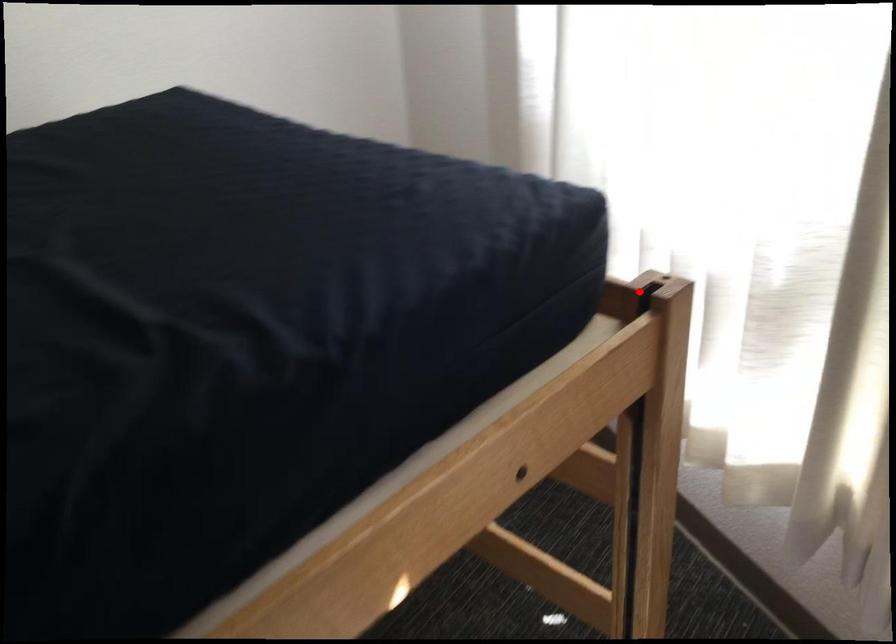
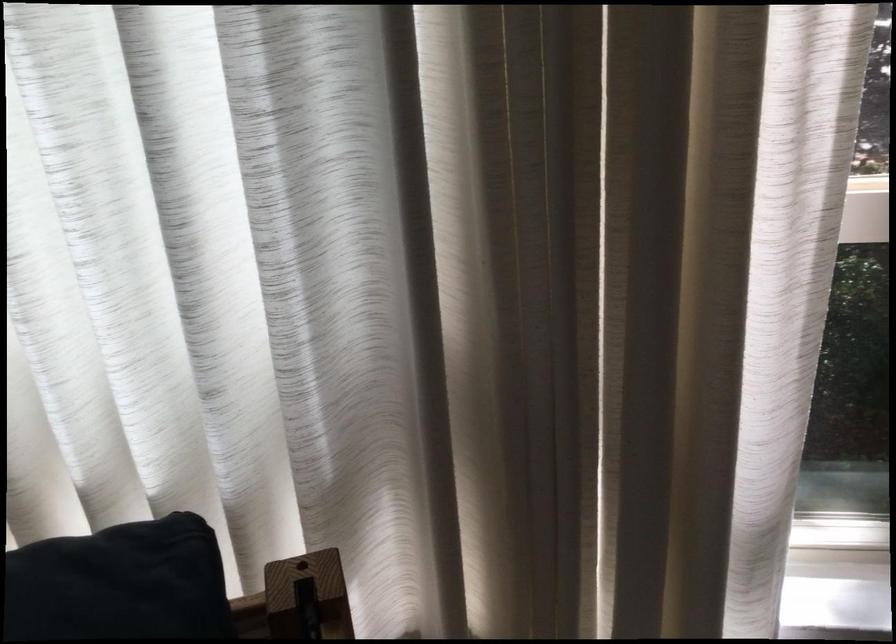
Question: I am providing you with two images of the same scene from different viewpoints. Given a red point in image1, look at the same physical point in image2. Is it:

Choices:
 (A) Closer to the viewpoint
 (B) Farther from the viewpoint

Answer: (A)